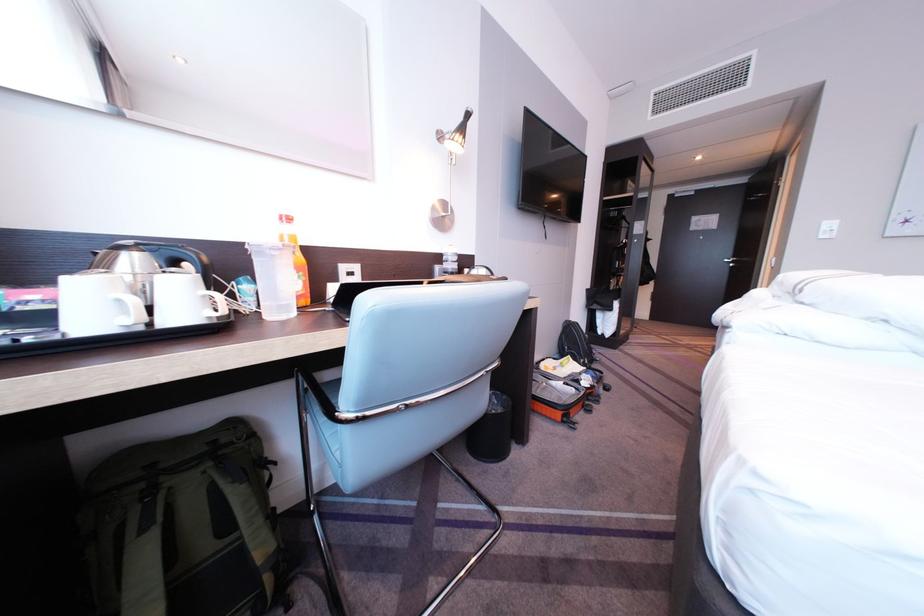
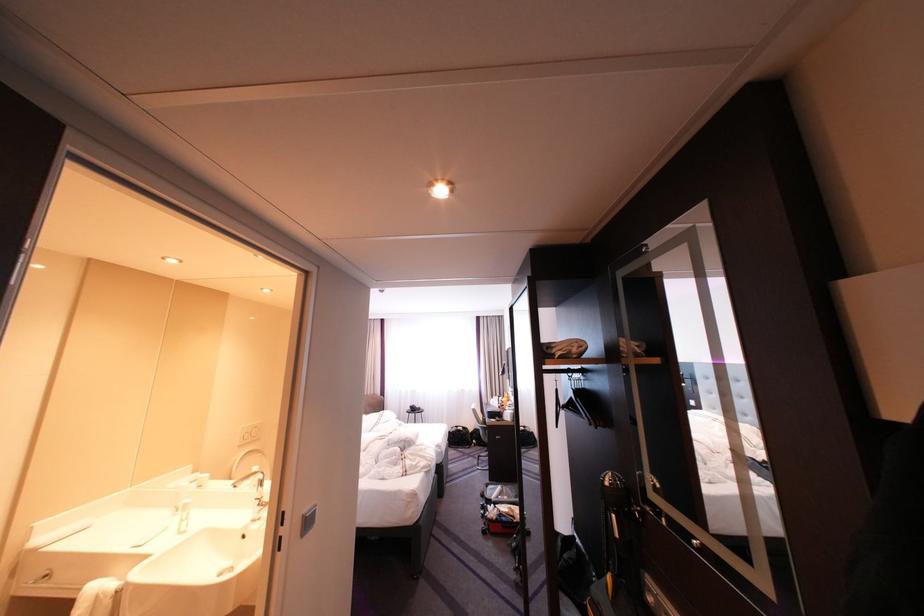
Question: I am providing you with two images of the same scene from different viewpoints. Please identify which objects are invisible in image2.

Choices:
 (A) black grill handle
 (B) open red suitcase
 (C) chrome faucet handle
 (D) lamp head

Answer: (D)